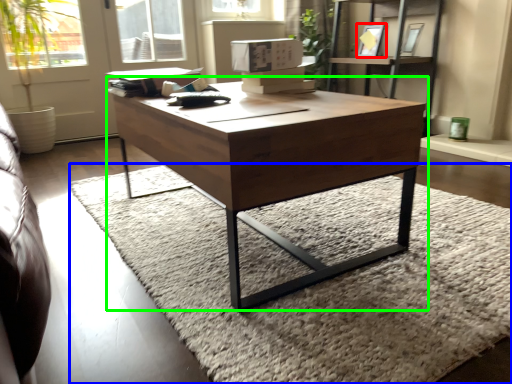
Question: Which object is the closest to the picture frame (highlighted by a red box)? Choose among these: mat (highlighted by a blue box) or coffee table (highlighted by a green box).

Choices:
 (A) mat
 (B) coffee table

Answer: (A)